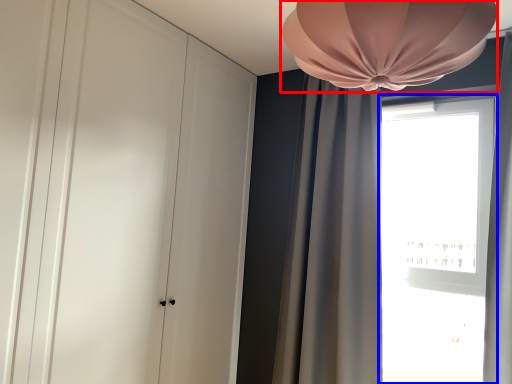
Question: Which object appears closest to the camera in this image, lamp (highlighted by a red box) or window (highlighted by a blue box)?

Choices:
 (A) lamp
 (B) window

Answer: (A)